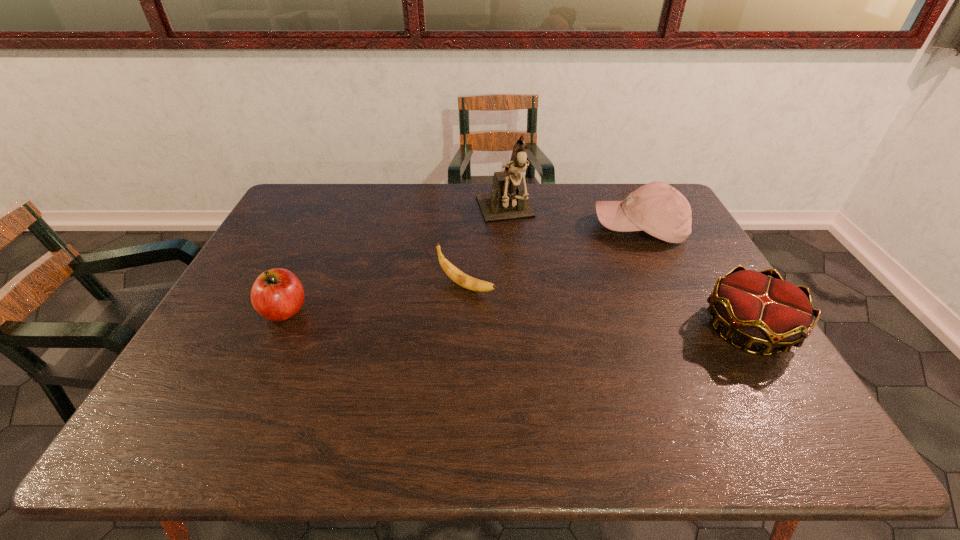
This screenshot has width=960, height=540. In order to click on the leftmost object in this screenshot , I will do `click(277, 294)`.

This screenshot has width=960, height=540. I want to click on crown, so click(770, 312).

Where is `banana`? The width and height of the screenshot is (960, 540). banana is located at coordinates [x=459, y=277].

This screenshot has width=960, height=540. In order to click on the tallest object in this screenshot , I will do `click(507, 201)`.

Where is `baseball cap`? The height and width of the screenshot is (540, 960). baseball cap is located at coordinates (657, 208).

I want to click on vacant space located 0.100m on the right of the leftmost object, so click(347, 311).

This screenshot has height=540, width=960. I want to click on blank area located 0.260m on the left of the crown, so point(601,328).

The width and height of the screenshot is (960, 540). I want to click on vacant space located on the peel of the banana from the top, so click(x=595, y=348).

Locate an element on the screen. The height and width of the screenshot is (540, 960). blank space located on the peel of the banana from the top is located at coordinates (584, 342).

Locate an element on the screen. The height and width of the screenshot is (540, 960). free space located on the peel of the banana from the top is located at coordinates (531, 316).